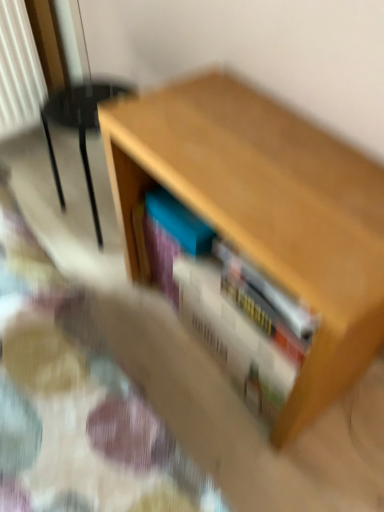
Question: Which is correct: velvet beige armchair at left is inside white matte book at center, or outside of it?

Choices:
 (A) inside
 (B) outside

Answer: (B)

Question: Considering the positions of velvet beige armchair at left and white matte book at center in the image, is velvet beige armchair at left taller or shorter than white matte book at center?

Choices:
 (A) short
 (B) tall

Answer: (B)

Question: Which object is positioned closest to the white matte book at center?

Choices:
 (A) blue matte book at center
 (B) wooden table at center
 (C) velvet beige armchair at left

Answer: (A)

Question: Which is nearer to the blue matte book at center?

Choices:
 (A) velvet beige armchair at left
 (B) wooden table at center
 (C) white matte book at center

Answer: (C)